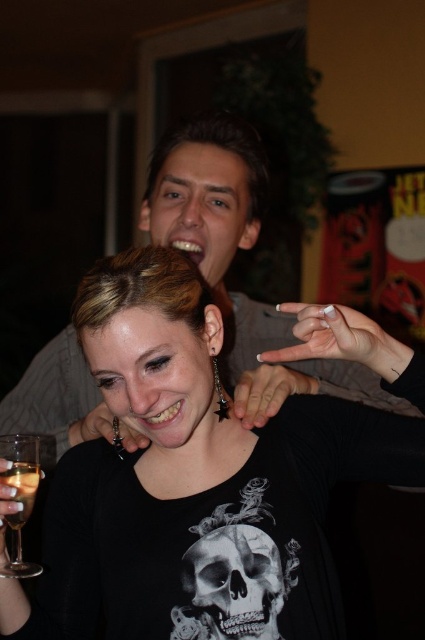
You are at a party and want to choose a wine glass that can hold more liquid. Which one between the clear glass wine glass at lower left and the translucent glass wine at lower left should you pick?

The clear glass wine glass at lower left is larger in size than the translucent glass wine at lower left, so it can hold more liquid.

Based on the photo, you are at a party and want to pour wine into the clear glass wine glass at lower left and the translucent glass wine at lower left. If both glasses are placed side by side, which one will require more wine to fill up to the brim?

The clear glass wine glass at lower left requires more wine to fill up to the brim because its width is larger than the translucent glass wine at lower left.

In the scene described, there is a black matte shirt at center and a translucent glass wine at lower left. From the perspective of someone standing in front of the scene, which object is positioned to the right of the other?

The black matte shirt at center is positioned to the right of the translucent glass wine at lower left.